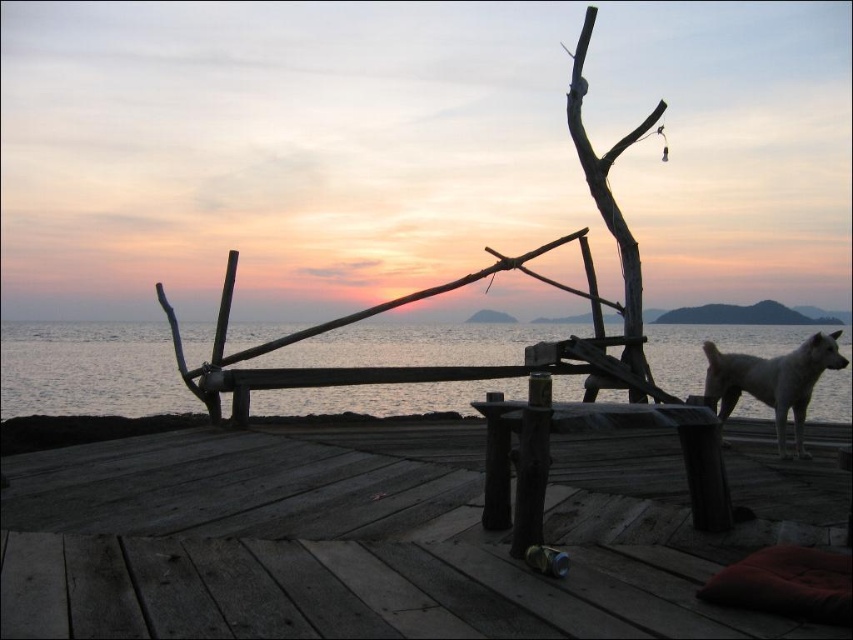
Does smooth water at center lie in front of white fur dog at right?

Yes, smooth water at center is in front of white fur dog at right.

Between smooth water at center and white fur dog at right, which one has more height?

With more height is smooth water at center.

Identify the location of smooth water at center. The image size is (853, 640). (90, 369).

Is smooth water at center in front of wooden picnic table at center?

That is False.

How far apart are smooth water at center and wooden picnic table at center?

They are 17.26 feet apart.

Does point (167, 376) come farther from viewer compared to point (611, 406)?

Yes, point (167, 376) is behind point (611, 406).

The height and width of the screenshot is (640, 853). I want to click on smooth water at center, so click(90, 369).

Is the position of wooden at center more distant than that of white fur dog at right?

No, it is not.

Which is more to the right, wooden at center or white fur dog at right?

Positioned to the right is white fur dog at right.

Does point (331, 595) lie behind point (729, 392)?

No, it is in front of (729, 392).

You are a GUI agent. You are given a task and a screenshot of the screen. Output one action in this format:
    pyautogui.click(x=<x>, y=<y>)
    Task: Click on the wooden at center
    The width and height of the screenshot is (853, 640).
    Given the screenshot: What is the action you would take?
    pyautogui.click(x=375, y=538)